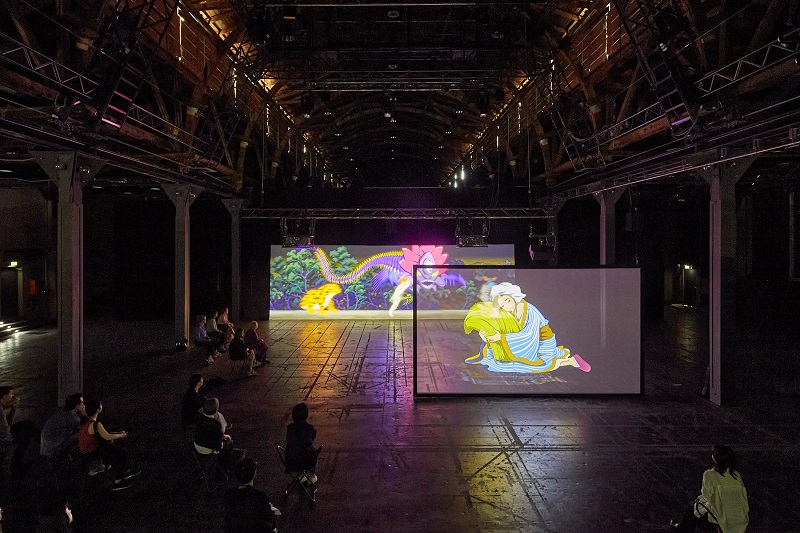
Where is `stairs`? stairs is located at coordinates (6, 326).